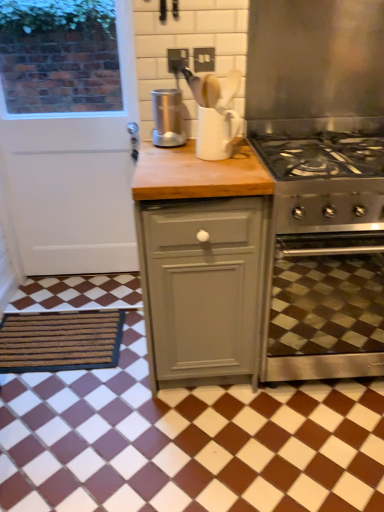
Where is `unoccupied area in front of matte gray cabinet at center`? unoccupied area in front of matte gray cabinet at center is located at coordinates (204, 445).